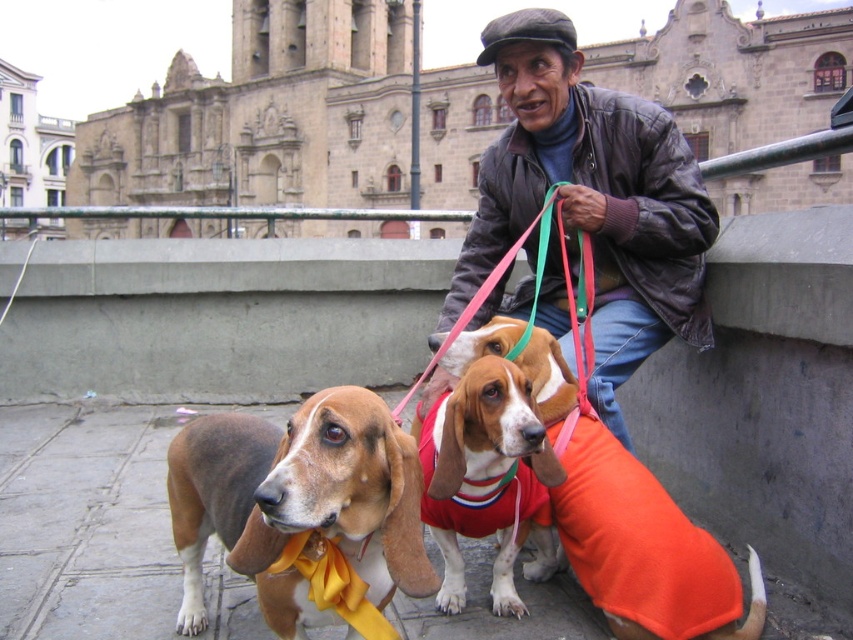
You are a photographer wanting to capture a closeup shot of the orange fleece sweater at center. Since the brown soft fabric dog at center is blocking the view, can you move the dog to the side? Explain why or why not based on their sizes.

The brown soft fabric dog at center is larger than the orange fleece sweater at center, so you can move the dog to the side to get a clear view of the sweater.

You are standing in the plaza and see the man with his dogs. You want to approach the leather jacket at center to ask a question. Which direction should you move relative to the brown soft fabric dog at center?

The leather jacket at center is to the right of the brown soft fabric dog at center, so you should move to the right of the brown soft fabric dog at center to reach the leather jacket at center.

You are a photographer trying to capture the orange fleece sweater at center and the brown and white fur at center in a single shot. Which object should you focus on first if you want to ensure both are in focus?

The orange fleece sweater at center is above brown and white fur at center, so you should focus on the orange fleece sweater at center first to ensure both are in focus since it is closer to the camera.